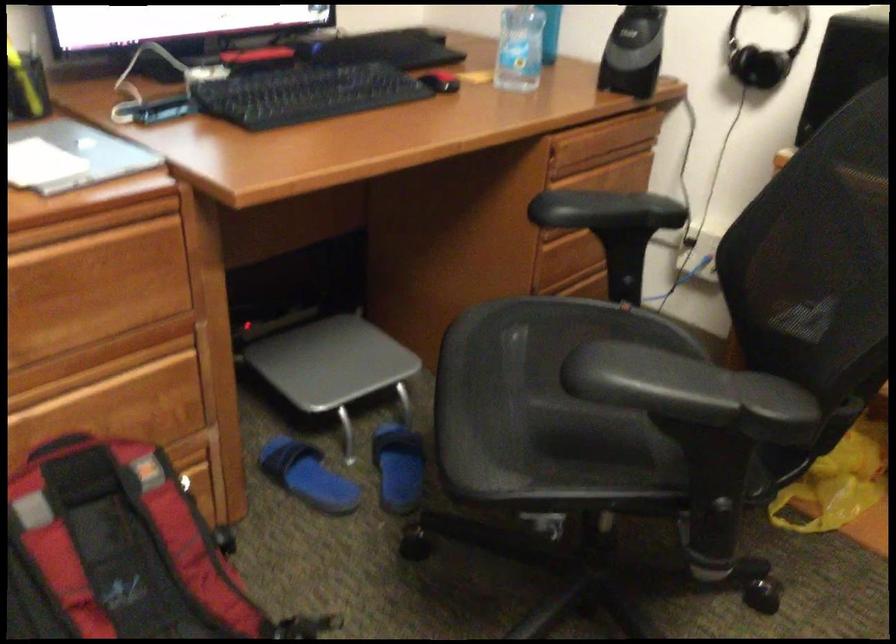
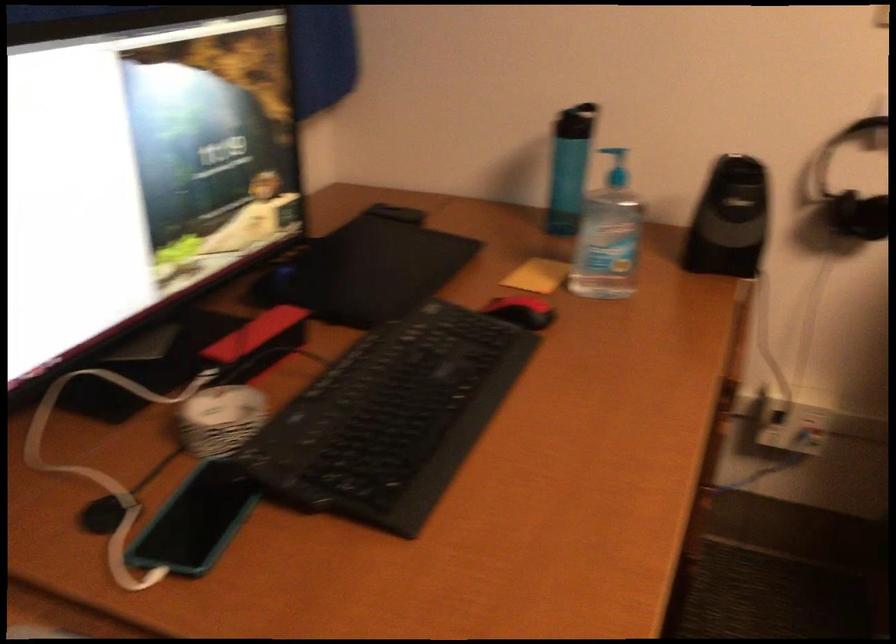
Question: The camera is either moving clockwise (left) or counter-clockwise (right) around the object. The first image is from the beginning of the video and the second image is from the end. Is the camera moving left or right when shooting the video?

Choices:
 (A) Left
 (B) Right

Answer: (A)